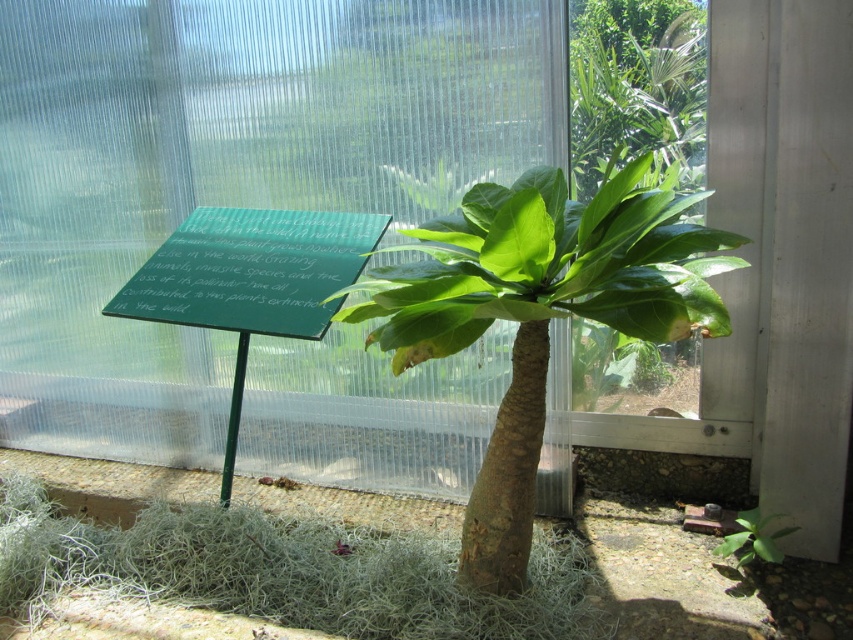
Who is shorter, green matte palm tree at center or green polished stone sign at center?

green polished stone sign at center

Which is below, green matte palm tree at center or green polished stone sign at center?

green matte palm tree at center is lower down.

What do you see at coordinates (541, 314) in the screenshot? Image resolution: width=853 pixels, height=640 pixels. I see `green matte palm tree at center` at bounding box center [541, 314].

Identify the location of green matte palm tree at center. The image size is (853, 640). (541, 314).

Who is higher up, transparent plastic window at center or green matte palm tree at center?

transparent plastic window at center is higher up.

Does transparent plastic window at center have a lesser width compared to green matte palm tree at center?

In fact, transparent plastic window at center might be wider than green matte palm tree at center.

Locate an element on the screen. The height and width of the screenshot is (640, 853). transparent plastic window at center is located at coordinates (227, 173).

Can you confirm if transparent plastic window at center is shorter than green polished stone sign at center?

Incorrect, transparent plastic window at center's height does not fall short of green polished stone sign at center's.

The image size is (853, 640). What do you see at coordinates (227, 173) in the screenshot?
I see `transparent plastic window at center` at bounding box center [227, 173].

Find the location of `transparent plastic window at center`. transparent plastic window at center is located at coordinates (227, 173).